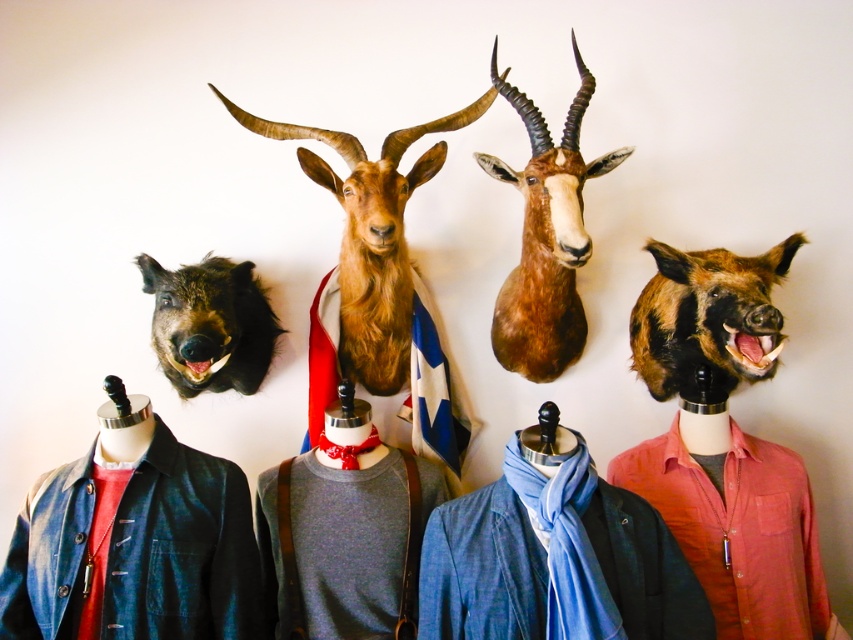
You are a museum visitor who wants to take a photo of both the denim jacket at lower left and the brown furry goat at center in the same frame. Given that your camera has a maximum focus range of 18 inches, will you be able to capture both subjects clearly in one shot?

The denim jacket at lower left is 17.56 inches away from the brown furry goat at center, so yes, the camera can capture both subjects clearly in one shot since the distance between them is within the 18 inches focus range.

You are a painter standing 1.5 meters away from the brown furry goat at center. Can you reach the goat with your 1.2 meter long paintbrush?

The distance between you and the brown furry goat at center is 1.47 meters. Since your paintbrush is 1.2 meters long, you cannot reach the goat as the distance is greater than the brush length.

You are an interior designer arranging a room with the brown furry goat at center and the fuzzy brown moose head at left. Which object is positioned higher up in the display?

The brown furry goat at center is positioned higher up in the display because it is located above the fuzzy brown moose head at left.